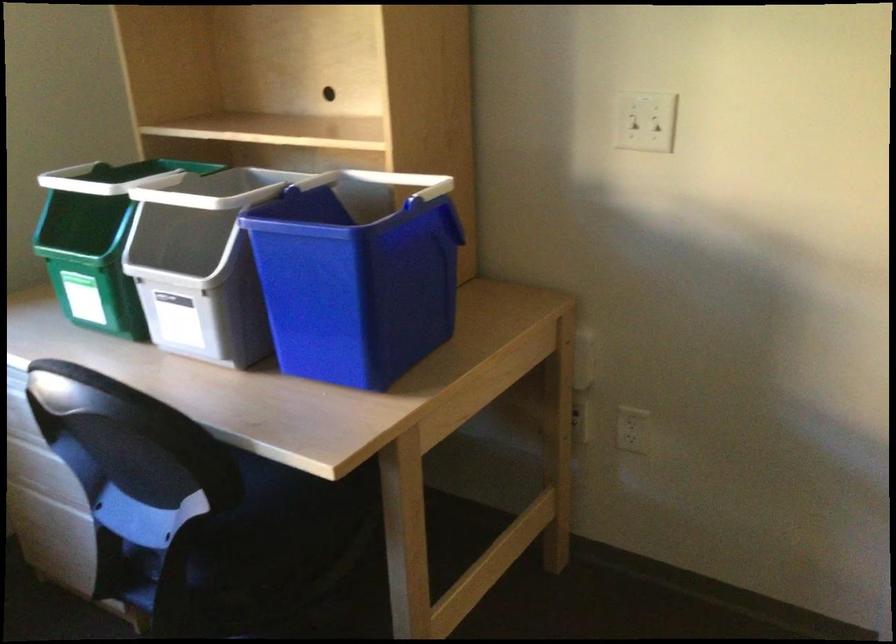
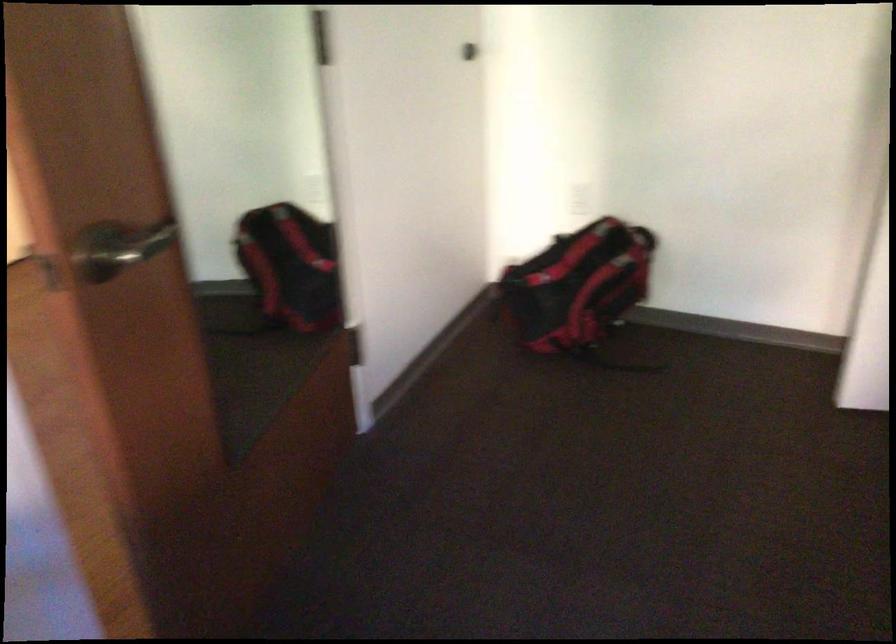
Based on the continuous images, in which direction is the camera rotating?

The camera's rotation is toward right-down.